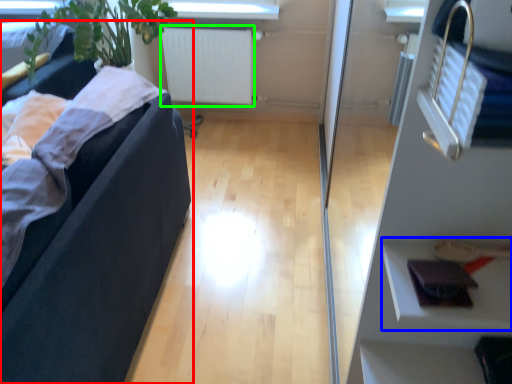
Question: Which is nearer to the studio couch (highlighted by a red box)? shelf (highlighted by a blue box) or radiator (highlighted by a green box).

Choices:
 (A) shelf
 (B) radiator

Answer: (A)